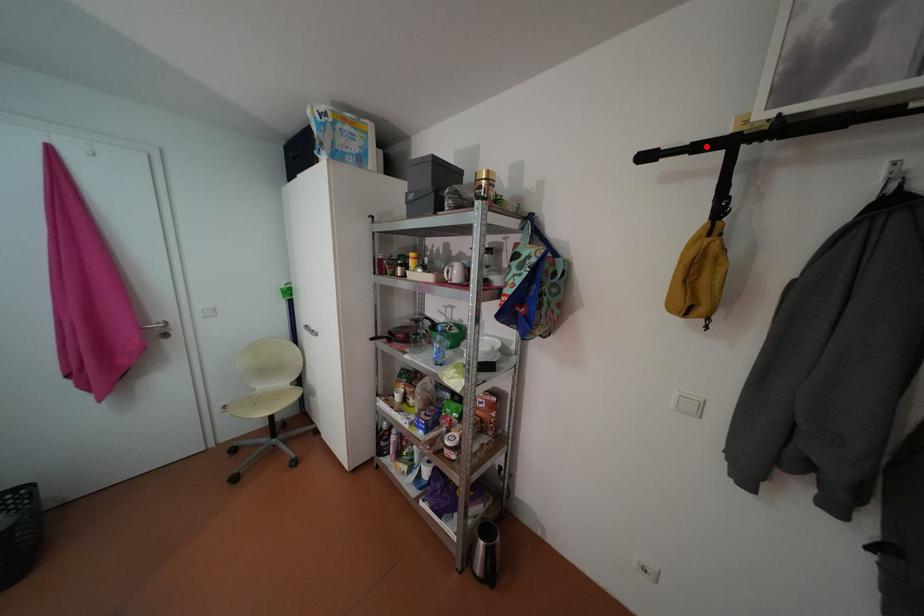
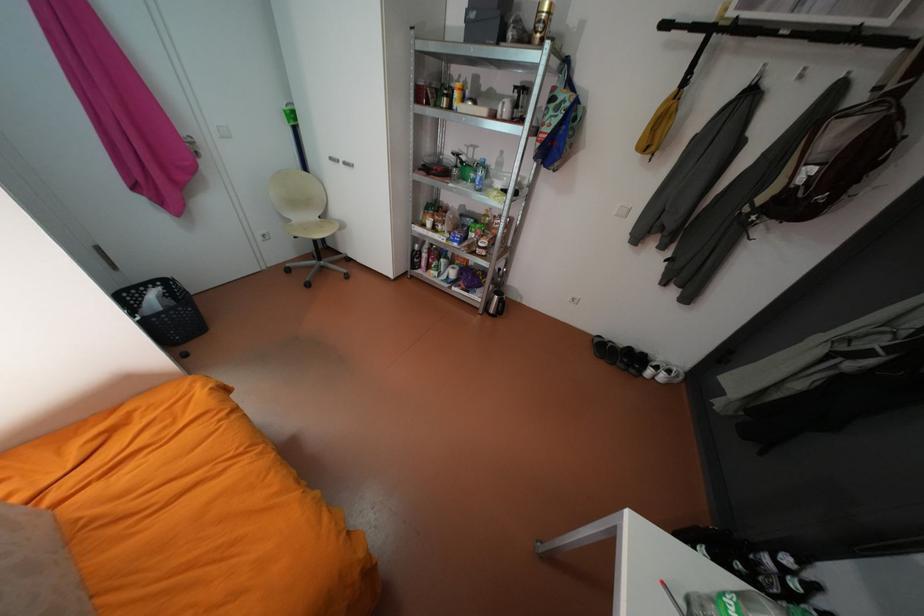
Question: I am providing you with two images of the same scene from different viewpoints. A red point is marked on the first image. Can you still see the location of the red point in image 2?

Choices:
 (A) Yes
 (B) No

Answer: (A)